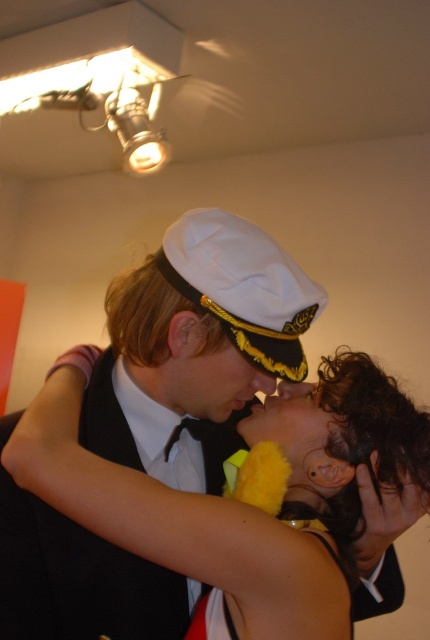
Does matte yellow fabric at center have a lesser height compared to matte white cap at center?

Incorrect, matte yellow fabric at center's height does not fall short of matte white cap at center's.

This screenshot has height=640, width=430. I want to click on matte yellow fabric at center, so (178, 524).

Who is more distant from viewer, (x=321, y=616) or (x=177, y=403)?

Positioned behind is point (x=177, y=403).

This screenshot has width=430, height=640. I want to click on matte yellow fabric at center, so click(x=178, y=524).

Can you confirm if matte yellow fabric at center is bigger than smooth yellow plush at center?

Indeed, matte yellow fabric at center has a larger size compared to smooth yellow plush at center.

Is matte yellow fabric at center thinner than smooth yellow plush at center?

In fact, matte yellow fabric at center might be wider than smooth yellow plush at center.

Who is more distant from viewer, (251,566) or (303,381)?

The point (303,381) is more distant.

The image size is (430, 640). I want to click on matte yellow fabric at center, so click(x=178, y=524).

Who is lower down, matte white cap at center or smooth yellow plush at center?

Positioned lower is smooth yellow plush at center.

Identify the location of matte white cap at center. The width and height of the screenshot is (430, 640). (211, 376).

Identify the location of matte white cap at center. The image size is (430, 640). (211, 376).